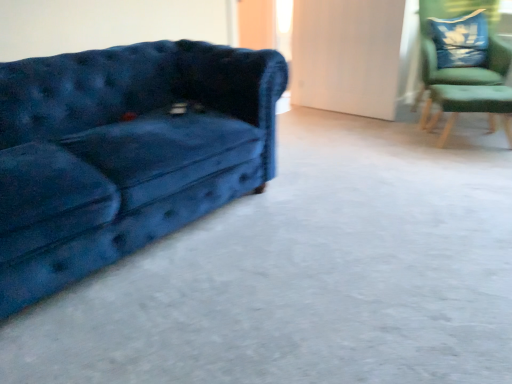
Question: Considering the relative positions of green fabric side table at right and green fabric chair at upper right in the image provided, is green fabric side table at right in front of green fabric chair at upper right?

Choices:
 (A) no
 (B) yes

Answer: (B)

Question: Is there a large distance between green fabric side table at right and green fabric chair at upper right?

Choices:
 (A) no
 (B) yes

Answer: (A)

Question: Can you confirm if green fabric side table at right is taller than green fabric chair at upper right?

Choices:
 (A) no
 (B) yes

Answer: (A)

Question: Considering the relative sizes of green fabric side table at right and green fabric chair at upper right in the image provided, is green fabric side table at right bigger than green fabric chair at upper right?

Choices:
 (A) yes
 (B) no

Answer: (B)

Question: Is green fabric side table at right outside green fabric chair at upper right?

Choices:
 (A) yes
 (B) no

Answer: (A)

Question: From the image's perspective, does green fabric side table at right appear lower than green fabric chair at upper right?

Choices:
 (A) yes
 (B) no

Answer: (A)

Question: Is blue velvet couch at left a part of velvet blue pillow at upper right?

Choices:
 (A) no
 (B) yes

Answer: (A)

Question: Would you consider velvet blue pillow at upper right to be distant from blue velvet couch at left?

Choices:
 (A) no
 (B) yes

Answer: (B)

Question: Is velvet blue pillow at upper right positioned beyond the bounds of blue velvet couch at left?

Choices:
 (A) yes
 (B) no

Answer: (A)

Question: From a real-world perspective, is velvet blue pillow at upper right located beneath blue velvet couch at left?

Choices:
 (A) yes
 (B) no

Answer: (B)

Question: Is velvet blue pillow at upper right placed right next to blue velvet couch at left?

Choices:
 (A) yes
 (B) no

Answer: (B)

Question: From the image's perspective, would you say velvet blue pillow at upper right is positioned over blue velvet couch at left?

Choices:
 (A) no
 (B) yes

Answer: (B)

Question: Is velvet blue couch at left next to green fabric chair at upper right and touching it?

Choices:
 (A) yes
 (B) no

Answer: (B)